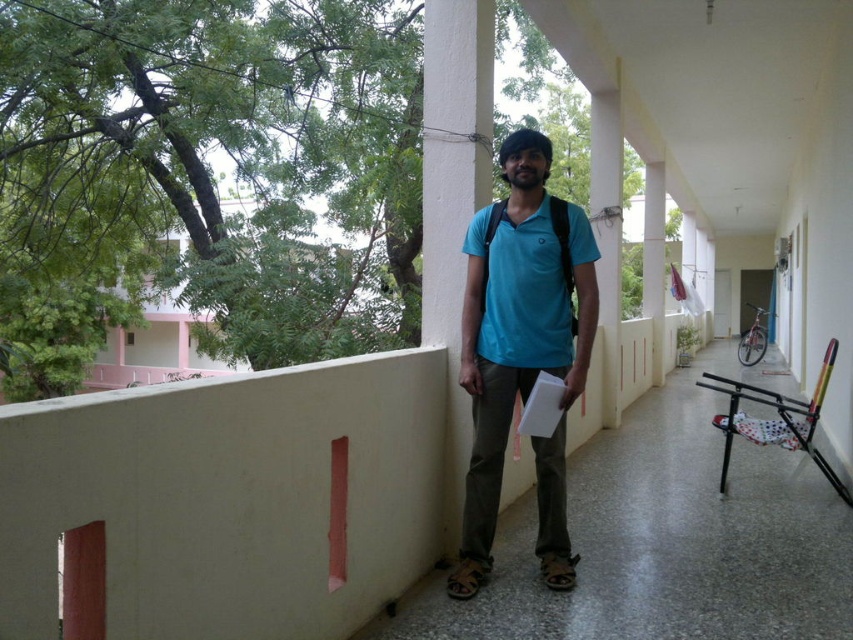
You are standing on a balcony and want to place a small potted plant between the matte blue shirt at center and the white smooth pillar at center. According to their positions, which object should the plant be closer to?

The matte blue shirt at center is positioned on the right side of the white smooth pillar at center, so the plant should be placed closer to the white smooth pillar at center to be between them.

You are a photographer trying to capture a photo of the matte blue shirt at center and the white smooth pillar at center. Which object should you focus on first if you want to ensure both are in focus without moving the camera?

You should focus on the matte blue shirt at center first because it is closer to the viewer than the white smooth pillar at center. By focusing on the closer object, the farther object will also be in focus due to the depth of field.

From the picture: You are standing on the balcony and want to place a small potted plant between the two points marked as point (509, 184) and point (426, 49). Which point should the plant be closer to in order to be positioned in front of the other point?

The plant should be closer to point (509, 184) because it is in front of point (426, 49).